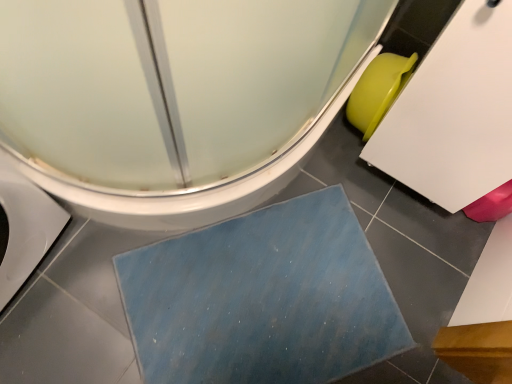
Where is `green matte toilet bowl at right`? green matte toilet bowl at right is located at coordinates (378, 91).

Image resolution: width=512 pixels, height=384 pixels. What do you see at coordinates (262, 298) in the screenshot?
I see `blue textured bath mat at lower center` at bounding box center [262, 298].

This screenshot has width=512, height=384. Identify the location of white glossy toilet at lower left. (177, 100).

Measure the distance between point (264, 7) and camera.

22.32 inches.

Where is `green matte toilet bowl at right`? green matte toilet bowl at right is located at coordinates (378, 91).

Is blue textured bath mat at lower center placed right next to green matte toilet bowl at right?

No, blue textured bath mat at lower center is not next to green matte toilet bowl at right.

Does blue textured bath mat at lower center have a larger size compared to green matte toilet bowl at right?

Correct, blue textured bath mat at lower center is larger in size than green matte toilet bowl at right.

From the picture: Can green matte toilet bowl at right be found inside blue textured bath mat at lower center?

No, green matte toilet bowl at right is not a part of blue textured bath mat at lower center.

Is green matte toilet bowl at right facing away from white glossy toilet at lower left?

No, white glossy toilet at lower left is not at the back of green matte toilet bowl at right.

Who is smaller, green matte toilet bowl at right or white glossy toilet at lower left?

With smaller size is green matte toilet bowl at right.

Is green matte toilet bowl at right in front of or behind white glossy toilet at lower left in the image?

Visually, green matte toilet bowl at right is located behind white glossy toilet at lower left.

Locate an element on the screen. toilet bowl to the right of white glossy toilet at lower left is located at coordinates (378, 91).

Choose the correct answer: Is green matte toilet bowl at right inside blue textured bath mat at lower center or outside it?

green matte toilet bowl at right lies outside blue textured bath mat at lower center.

In the scene shown: Which is in front, green matte toilet bowl at right or blue textured bath mat at lower center?

blue textured bath mat at lower center is more forward.

Considering the relative sizes of green matte toilet bowl at right and blue textured bath mat at lower center in the image provided, is green matte toilet bowl at right wider than blue textured bath mat at lower center?

No.

Is green matte toilet bowl at right next to blue textured bath mat at lower center and touching it?

No, green matte toilet bowl at right is not next to blue textured bath mat at lower center.

Considering their positions, is white glossy toilet at lower left located in front of or behind green matte toilet bowl at right?

Clearly, white glossy toilet at lower left is in front of green matte toilet bowl at right.

Are white glossy toilet at lower left and green matte toilet bowl at right making contact?

No, white glossy toilet at lower left is not with green matte toilet bowl at right.

From a real-world perspective, between white glossy toilet at lower left and green matte toilet bowl at right, who is vertically lower?

white glossy toilet at lower left, from a real-world perspective.

Looking at this image, considering the sizes of white glossy toilet at lower left and blue textured bath mat at lower center in the image, is white glossy toilet at lower left taller or shorter than blue textured bath mat at lower center?

Clearly, white glossy toilet at lower left is taller compared to blue textured bath mat at lower center.

Which object is positioned more to the right, white glossy toilet at lower left or blue textured bath mat at lower center?

blue textured bath mat at lower center.

Considering the sizes of objects white glossy toilet at lower left and blue textured bath mat at lower center in the image provided, who is bigger, white glossy toilet at lower left or blue textured bath mat at lower center?

With larger size is white glossy toilet at lower left.

Which of these two, blue textured bath mat at lower center or white glossy toilet at lower left, is smaller?

blue textured bath mat at lower center is smaller.

Identify the location of toilet lying in front of the blue textured bath mat at lower center. The height and width of the screenshot is (384, 512). (177, 100).

Is blue textured bath mat at lower center in contact with white glossy toilet at lower left?

No, blue textured bath mat at lower center is not making contact with white glossy toilet at lower left.

This screenshot has width=512, height=384. I want to click on toilet bowl behind the blue textured bath mat at lower center, so click(x=378, y=91).

Identify the location of toilet that appears above the green matte toilet bowl at right (from the image's perspective). The width and height of the screenshot is (512, 384). (177, 100).

Based on their spatial positions, is blue textured bath mat at lower center or white glossy toilet at lower left closer to green matte toilet bowl at right?

white glossy toilet at lower left lies closer to green matte toilet bowl at right than the other object.

Looking at the image, which one is located further to white glossy toilet at lower left, blue textured bath mat at lower center or green matte toilet bowl at right?

green matte toilet bowl at right is positioned further to the anchor white glossy toilet at lower left.

Looking at the image, which one is located closer to green matte toilet bowl at right, white glossy toilet at lower left or blue textured bath mat at lower center?

Result: Among the two, white glossy toilet at lower left is located nearer to green matte toilet bowl at right.

Looking at the image, which one is located further to white glossy toilet at lower left, green matte toilet bowl at right or blue textured bath mat at lower center?

Among the two, green matte toilet bowl at right is located further to white glossy toilet at lower left.

From the picture: Based on their spatial positions, is white glossy toilet at lower left or green matte toilet bowl at right closer to blue textured bath mat at lower center?

white glossy toilet at lower left is closer to blue textured bath mat at lower center.

Which object lies nearer to the anchor point blue textured bath mat at lower center, green matte toilet bowl at right or white glossy toilet at lower left?

white glossy toilet at lower left is positioned closer to the anchor blue textured bath mat at lower center.

Find the location of a particular element. The width and height of the screenshot is (512, 384). toilet bowl between white glossy toilet at lower left and blue textured bath mat at lower center in the up-down direction is located at coordinates (378, 91).